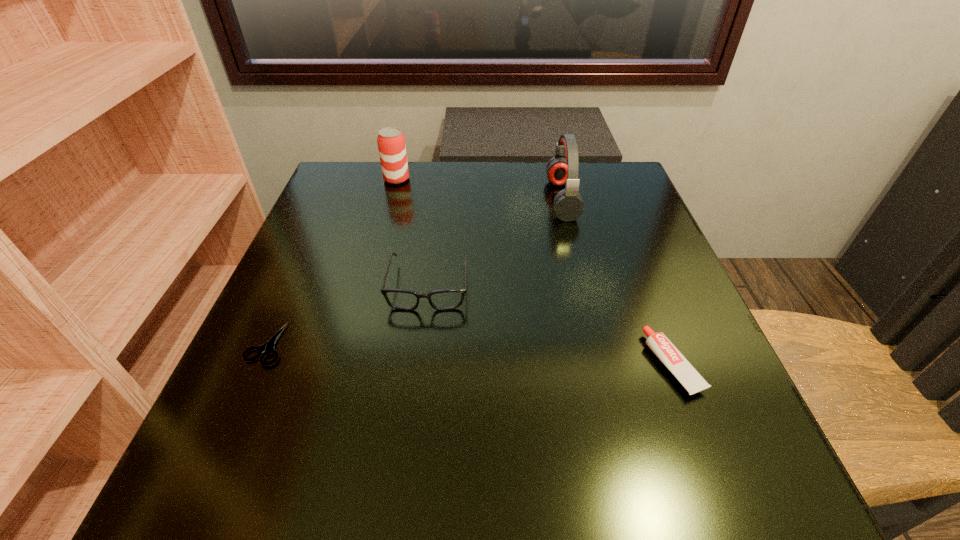
This screenshot has width=960, height=540. I want to click on vacant region located 0.070m on the ear cups of the earphone, so point(519,199).

The width and height of the screenshot is (960, 540). I want to click on vacant space situated 0.260m on the ear cups of the earphone, so click(x=441, y=199).

Locate an element on the screen. vacant space situated on the ear cups of the earphone is located at coordinates (383, 199).

Identify the location of free spot located 0.250m on the right of the fourth object from right to left. (507, 179).

Locate an element on the screen. Image resolution: width=960 pixels, height=540 pixels. blank space located 0.330m on the front-facing side of the third object from right to left is located at coordinates (401, 508).

Locate an element on the screen. free space located on the back of the second shortest object is located at coordinates (628, 248).

Find the location of a particular element. vacant space located 0.090m on the back of the leftmost object is located at coordinates (293, 287).

Where is `earphone present at the far edge`? The width and height of the screenshot is (960, 540). earphone present at the far edge is located at coordinates (562, 169).

You are a GUI agent. You are given a task and a screenshot of the screen. Output one action in this format:
    pyautogui.click(x=<x>, y=<y>)
    Task: Click on the beer can that is positioned at the far edge
    The width and height of the screenshot is (960, 540).
    Given the screenshot: What is the action you would take?
    pyautogui.click(x=391, y=141)

Where is `beer can situated at the left edge`? This screenshot has height=540, width=960. beer can situated at the left edge is located at coordinates (391, 141).